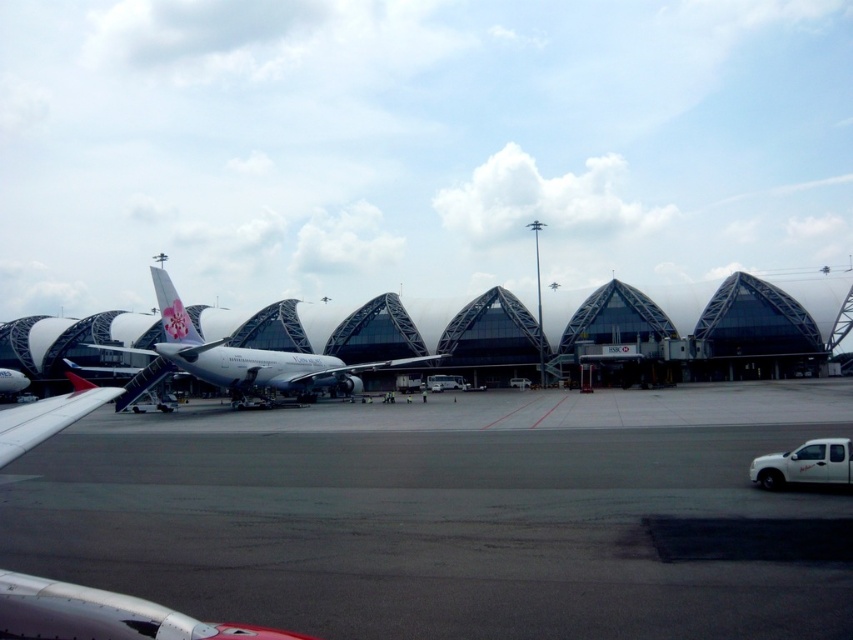
You are a pilot who just landed at the airport. You need to taxi to the jet bridge to disembark passengers. Based on the image, where is the dark gray asphalt at center located in relation to the jet bridge?

The dark gray asphalt at center is located at coordinates point (444, 515). Since the jet bridge is connected to the parked commercial jet in the midground, the asphalt is likely positioned centrally in the scene, possibly leading towards the terminal buildings and the jet bridge. However, without additional spatial data, the exact relation cannot be determined beyond its central position.

You are a passenger disembarking from the jet bridge and want to reach the white matte truck at lower right. The dark gray asphalt at center is in your path. Is the truck behind or in front of the asphalt?

The dark gray asphalt at center is in front of the white matte truck at lower right, so the truck is behind the asphalt from your perspective.

Consider the image. You are an airport security officer checking the parking area. You see a white matte truck at lower right and a white matte car at center. Which vehicle is wider?

The white matte truck at lower right is wider than the white matte car at center.